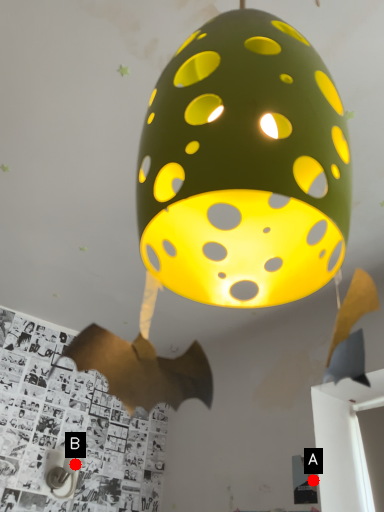
Question: Two points are circled on the image, labeled by A and B beside each circle. Which point appears closest to the camera in this image?

Choices:
 (A) A is closer
 (B) B is closer

Answer: (A)